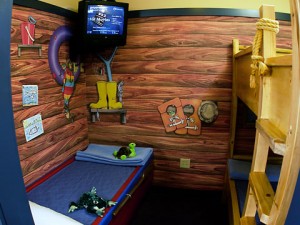
This screenshot has height=225, width=300. Find the location of `2 stuffed animals`. 2 stuffed animals is located at coordinates (94, 196), (128, 151).